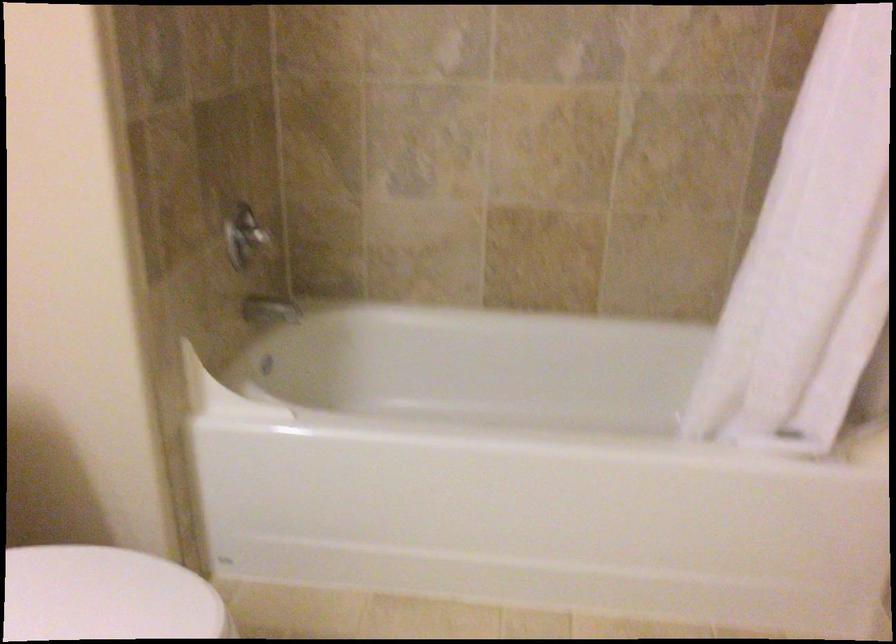
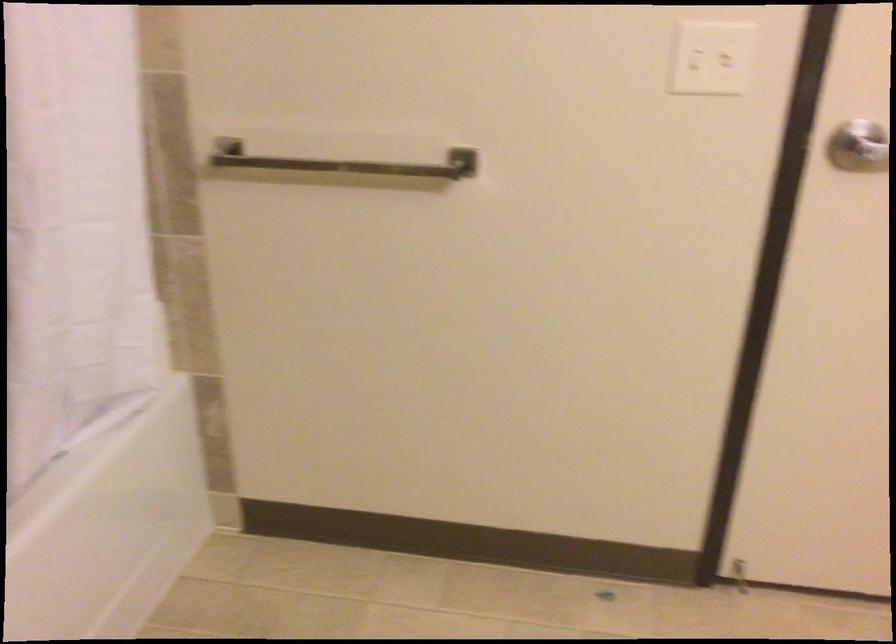
Based on the continuous images, in which direction is the camera rotating?

The camera rotated toward right-down.